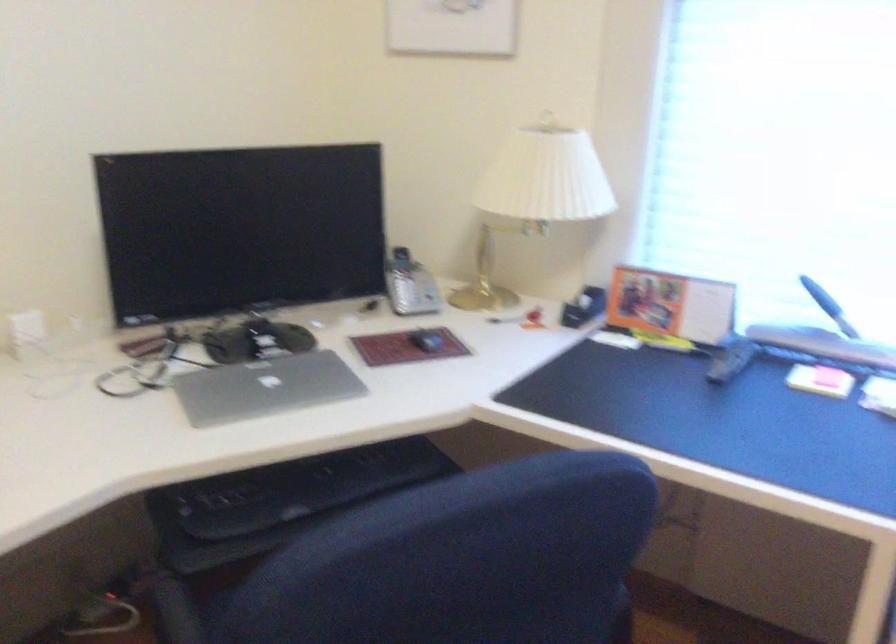
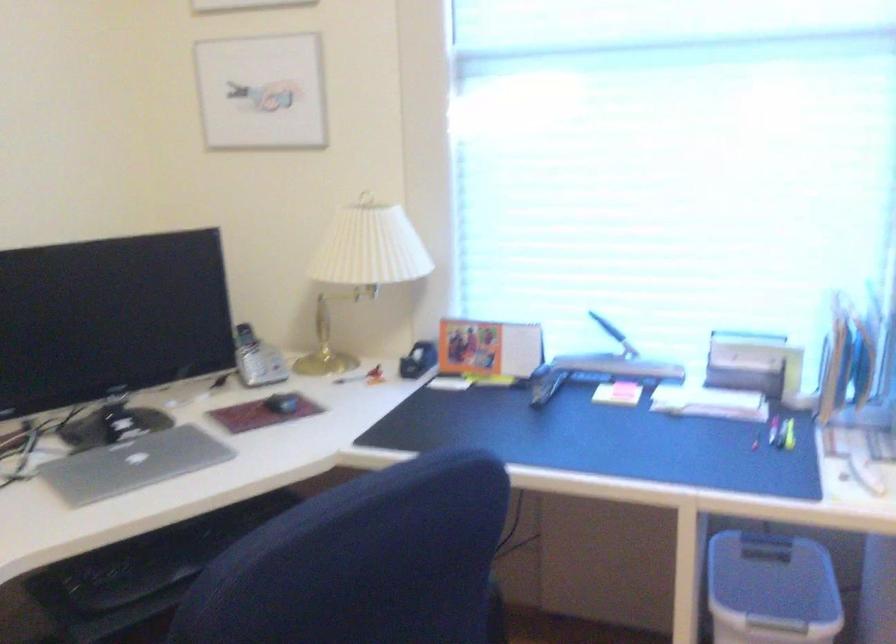
The point at (426, 339) is marked in the first image. Where is the corresponding point in the second image?

(281, 402)